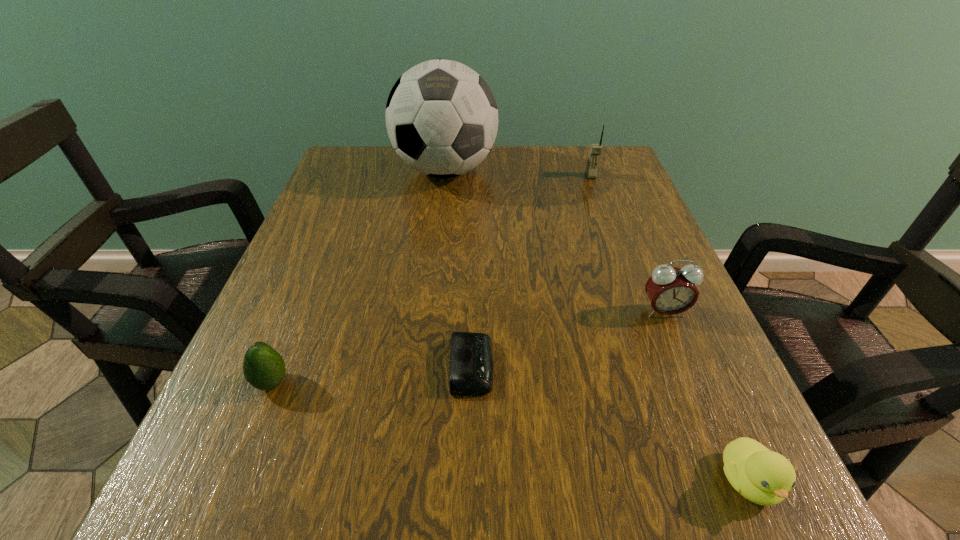
Locate an element on the screen. Image resolution: width=960 pixels, height=540 pixels. duckling that is at the right edge is located at coordinates (764, 477).

Identify the location of object present at the far left corner. (441, 116).

The height and width of the screenshot is (540, 960). I want to click on object at the far right corner, so click(595, 150).

Locate an element on the screen. object at the near right corner is located at coordinates (764, 477).

Find the location of a particular element. This screenshot has width=960, height=540. vacant space at the far edge of the desktop is located at coordinates (420, 183).

This screenshot has width=960, height=540. Find the location of `blank space at the near edge of the desktop`. blank space at the near edge of the desktop is located at coordinates (493, 510).

Image resolution: width=960 pixels, height=540 pixels. What are the coordinates of `vacant space at the left edge of the desktop` in the screenshot? It's located at (333, 226).

Image resolution: width=960 pixels, height=540 pixels. Find the location of `vacant area at the right edge of the desktop`. vacant area at the right edge of the desktop is located at coordinates (594, 202).

The height and width of the screenshot is (540, 960). I want to click on free space at the far left corner of the desktop, so [x=368, y=152].

In the image, there is a desktop. Identify the location of vacant space at the near left corner. (290, 523).